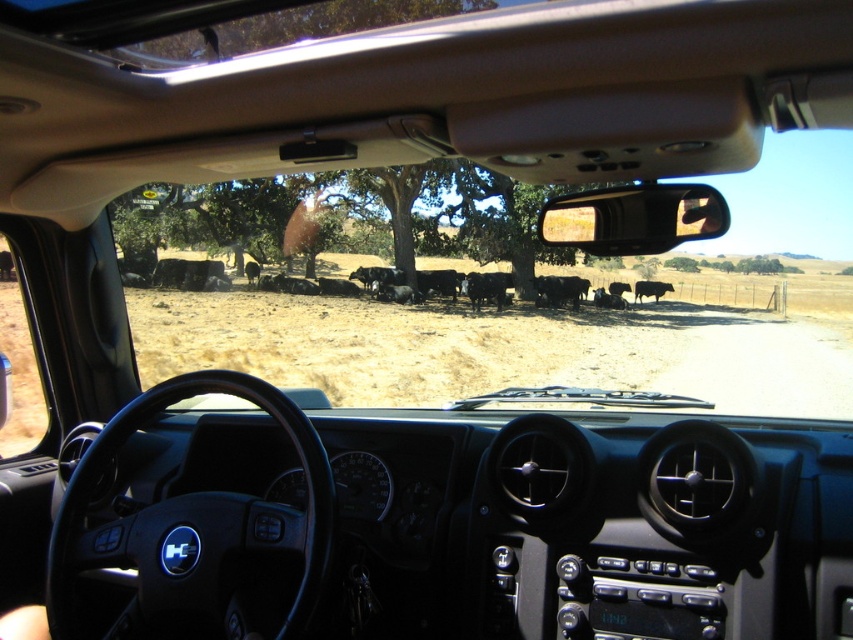
Is black matte cows at center shorter than transparent glass window at lower left?

In fact, black matte cows at center may be taller than transparent glass window at lower left.

What do you see at coordinates (520, 342) in the screenshot? This screenshot has height=640, width=853. I see `black matte cows at center` at bounding box center [520, 342].

The image size is (853, 640). I want to click on black matte cows at center, so click(x=520, y=342).

Is black matte cows at center smaller than black glossy cow at center?

No, black matte cows at center is not smaller than black glossy cow at center.

Is point (242, 353) closer to camera compared to point (635, 285)?

Yes, it is.

Where is `black matte cows at center`? This screenshot has width=853, height=640. black matte cows at center is located at coordinates (520, 342).

Is point (202, 52) positioned behind point (20, 381)?

No, it is not.

Consider the image. Is green leafy tree at upper center above transparent glass window at lower left?

Correct, green leafy tree at upper center is located above transparent glass window at lower left.

You are a GUI agent. You are given a task and a screenshot of the screen. Output one action in this format:
    pyautogui.click(x=<x>, y=<y>)
    Task: Click on the green leafy tree at upper center
    This screenshot has width=853, height=640.
    Given the screenshot: What is the action you would take?
    pyautogui.click(x=285, y=28)

Find the location of a particular element. The height and width of the screenshot is (640, 853). green leafy tree at upper center is located at coordinates (285, 28).